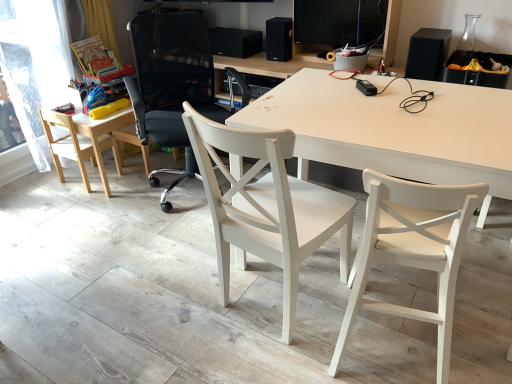
I want to click on vacant space in front of white wood chair at center, placed as the 2th chair when sorted from right to left, so click(265, 357).